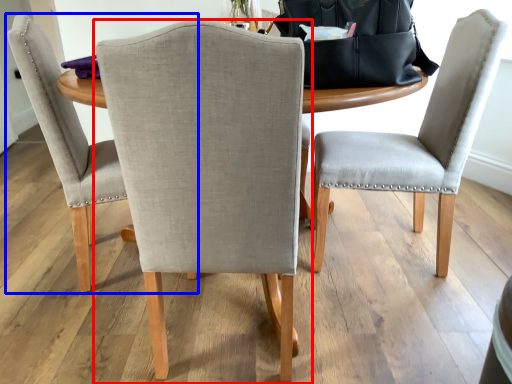
Question: Which object appears farthest to the camera in this image, chair (highlighted by a red box) or chair (highlighted by a blue box)?

Choices:
 (A) chair
 (B) chair

Answer: (B)